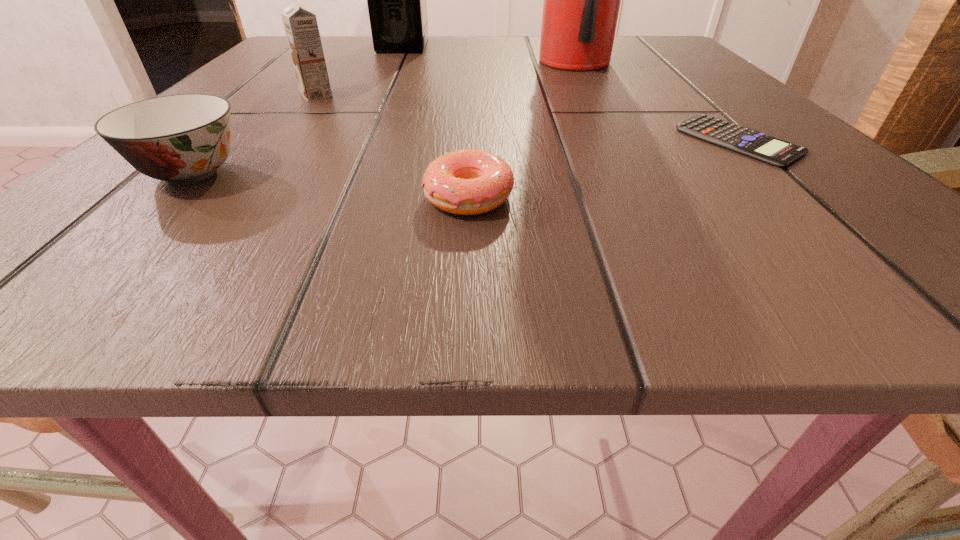
Image resolution: width=960 pixels, height=540 pixels. In order to click on the tallest object in this screenshot , I will do [x=581, y=5].

What are the coordinates of `the fifth object from left to right` in the screenshot? It's located at (581, 5).

The image size is (960, 540). Find the location of `the fifth shortest object`. the fifth shortest object is located at coordinates (397, 6).

Find the location of a particular element. The width and height of the screenshot is (960, 540). liquor is located at coordinates pos(397,6).

You are a GUI agent. You are given a task and a screenshot of the screen. Output one action in this format:
    pyautogui.click(x=<x>, y=<y>)
    Task: Click on the third tallest object
    The image size is (960, 540).
    Given the screenshot: What is the action you would take?
    pyautogui.click(x=301, y=28)

This screenshot has width=960, height=540. Identify the location of chocolate milk. click(x=301, y=28).

The height and width of the screenshot is (540, 960). Identify the location of the third shortest object. (183, 139).

Where is `the third object from right to left`? This screenshot has width=960, height=540. the third object from right to left is located at coordinates (467, 182).

This screenshot has width=960, height=540. What are the coordinates of `doughnut` in the screenshot? It's located at (467, 182).

Identify the location of calculator. (753, 143).